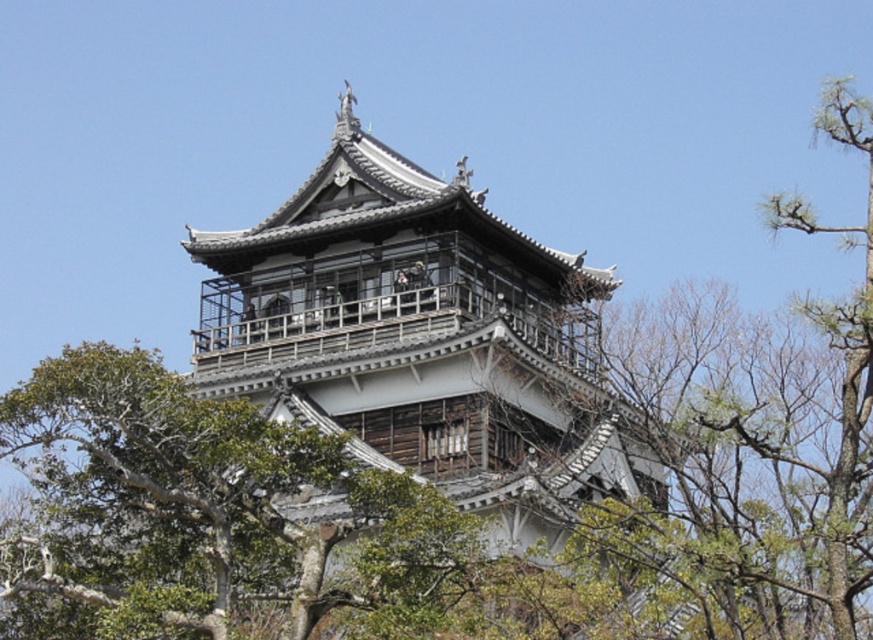
Is gray wooden pagoda at center to the right of green leafy tree at upper right from the viewer's perspective?

Incorrect, gray wooden pagoda at center is not on the right side of green leafy tree at upper right.

Is point (582, 291) positioned behind point (768, 417)?

Yes, it is.

Locate an element on the screen. Image resolution: width=873 pixels, height=640 pixels. gray wooden pagoda at center is located at coordinates (423, 339).